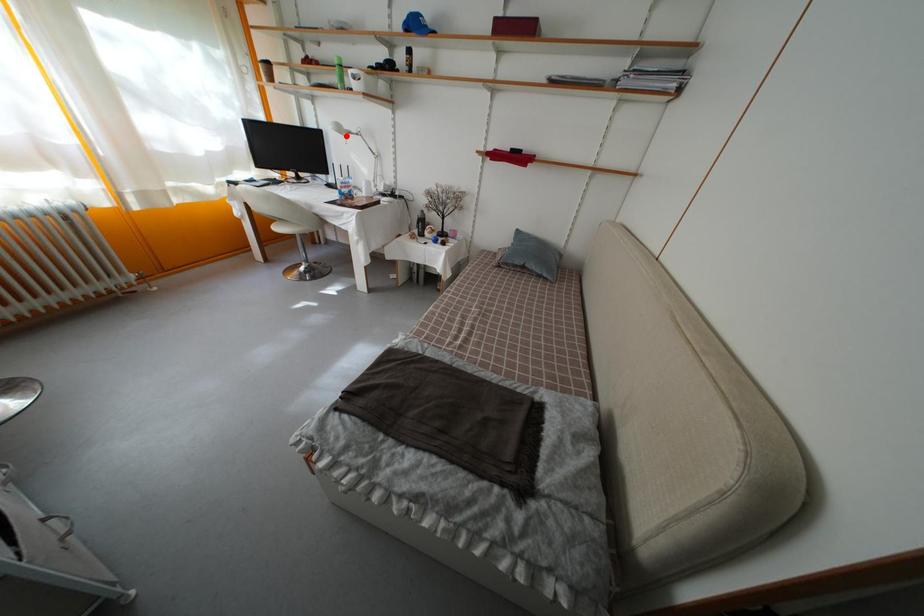
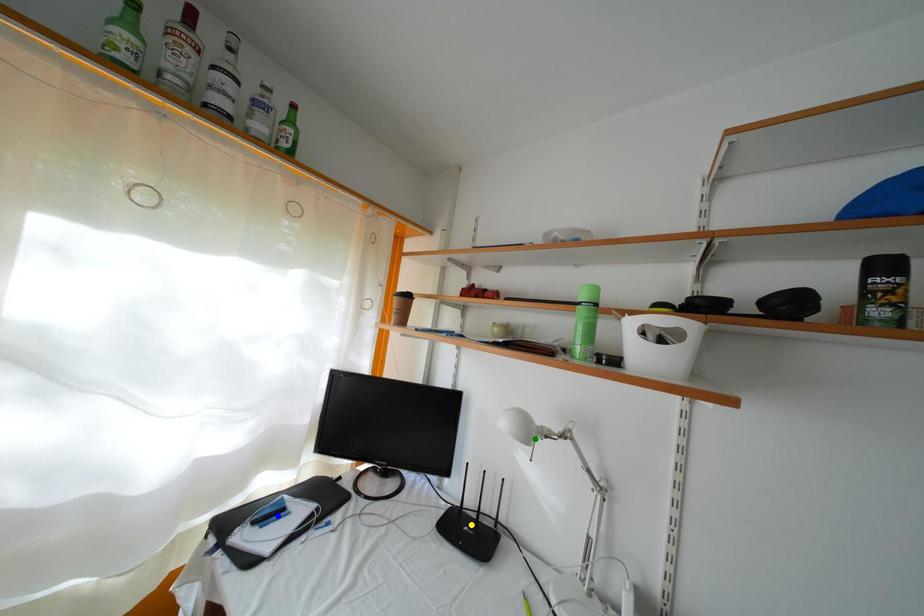
Question: I am providing you with two images of the same scene from different viewpoints. A red point is marked on the first image. You are given multiple points on the second image. In image 2, which mark is for the same physical point as the one in image 1?

Choices:
 (A) green point
 (B) yellow point
 (C) blue point

Answer: (A)